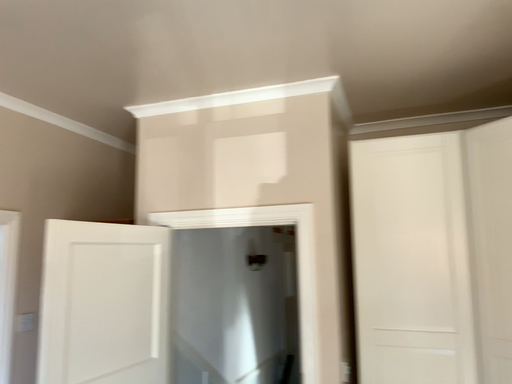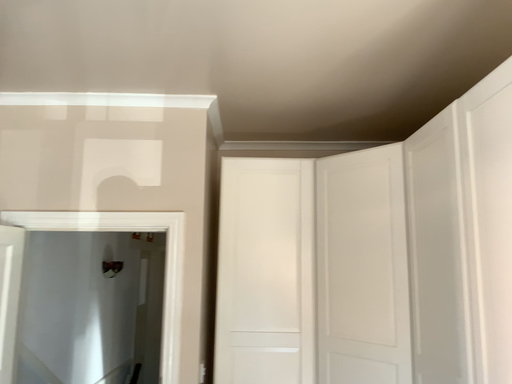
Question: How did the camera likely rotate when shooting the video?

Choices:
 (A) rotated right
 (B) rotated left

Answer: (A)